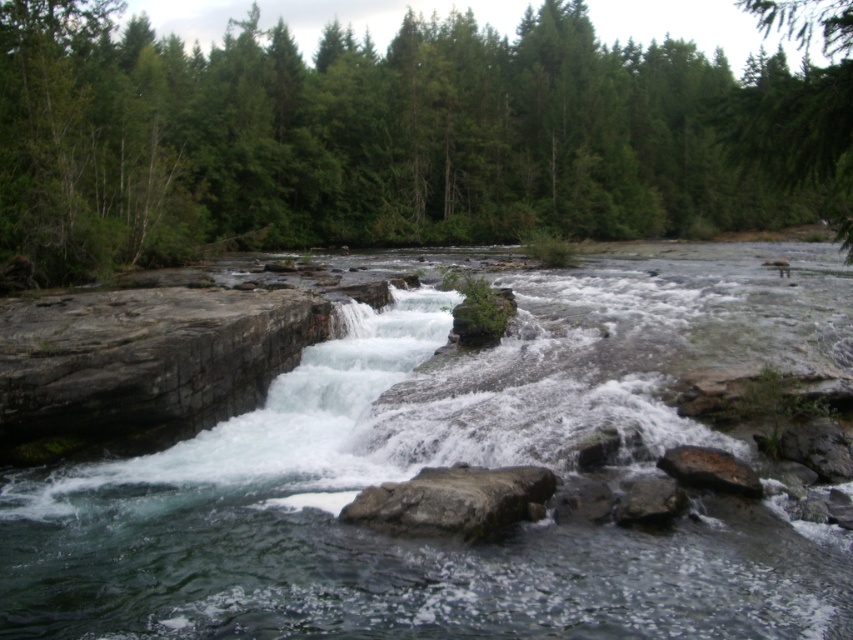
Question: Based on their relative distances, which object is nearer to the smooth gray rock at lower right?

Choices:
 (A) green textured tree at upper right
 (B) clear stone river at center
 (C) gray rough rock at center

Answer: (C)

Question: Which of these objects is positioned farthest from the clear stone river at center?

Choices:
 (A) green textured tree at upper right
 (B) smooth gray rock at lower center
 (C) green matte tree at upper center

Answer: (C)

Question: Can you confirm if green textured tree at upper right is wider than smooth gray rock at lower center?

Choices:
 (A) yes
 (B) no

Answer: (A)

Question: Can you confirm if clear stone river at center is wider than smooth gray rock at lower center?

Choices:
 (A) no
 (B) yes

Answer: (B)

Question: Which point is farther from the camera taking this photo?

Choices:
 (A) [x=693, y=451]
 (B) [x=793, y=36]
 (C) [x=73, y=116]

Answer: (B)

Question: Is gray rough rock at center thinner than smooth gray rock at lower center?

Choices:
 (A) no
 (B) yes

Answer: (A)